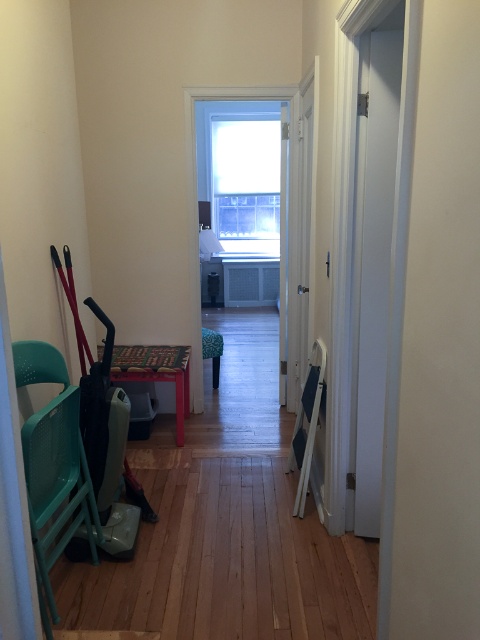
Question: Which point is farther from the camera taking this photo?

Choices:
 (A) (112, 353)
 (B) (70, 420)
 (C) (217, 336)

Answer: (C)

Question: Which of these objects is positioned closest to the teal plastic chair at left?

Choices:
 (A) green fabric stool at center
 (B) wooden table at center

Answer: (B)

Question: Is teal plastic chair at left in front of green fabric stool at center?

Choices:
 (A) yes
 (B) no

Answer: (A)

Question: Is teal plastic chair at left bigger than wooden table at center?

Choices:
 (A) yes
 (B) no

Answer: (A)

Question: Does teal plastic chair at left appear over wooden table at center?

Choices:
 (A) no
 (B) yes

Answer: (A)

Question: Estimate the real-world distances between objects in this image. Which object is farther from the green fabric stool at center?

Choices:
 (A) teal plastic chair at left
 (B) wooden table at center

Answer: (A)